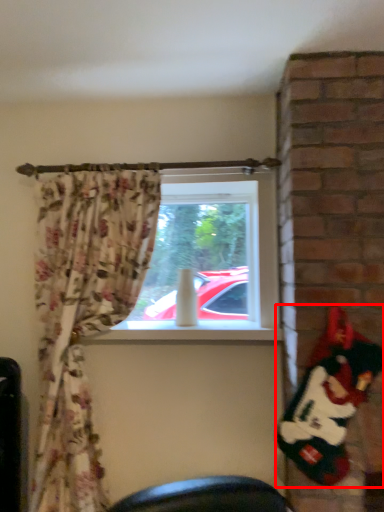
Question: Observing the image, what is the correct spatial positioning of santa claus (annotated by the red box) in reference to window screen?

Choices:
 (A) left
 (B) right

Answer: (B)